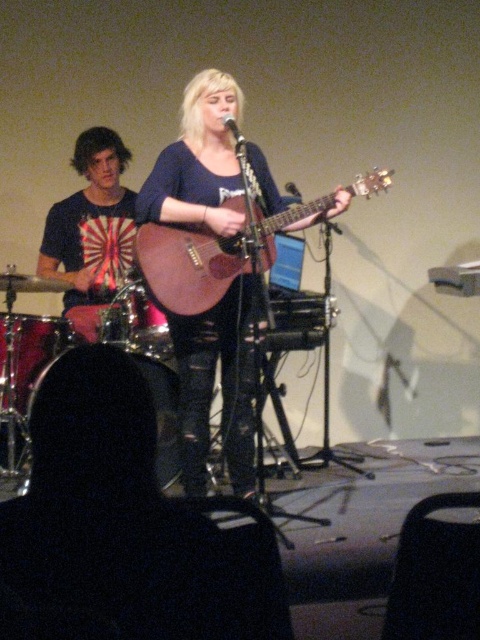
Find the location of a particular element. Image resolution: width=480 pixels, height=640 pixels. shiny silver drum at lower left is located at coordinates (105, 419).

How much distance is there between shiny silver drum at lower left and brushed metal drum at left?

shiny silver drum at lower left and brushed metal drum at left are 23.74 inches apart from each other.

Is point (80, 420) closer to camera compared to point (34, 337)?

Yes, point (80, 420) is in front of point (34, 337).

Find the location of a particular element. This screenshot has height=640, width=480. shiny silver drum at lower left is located at coordinates (105, 419).

Is matte brown guitar at center further to the viewer compared to shiny silver drum at lower left?

No, it is in front of shiny silver drum at lower left.

Does point (203, 417) come closer to viewer compared to point (132, 419)?

No, it is behind (132, 419).

Does point (244, 307) come closer to viewer compared to point (126, 362)?

No, it is behind (126, 362).

Locate an element on the screen. The image size is (480, 640). matte brown guitar at center is located at coordinates (213, 387).

Between matte brown guitar at center and brushed metal drum at lower left, which one appears on the right side from the viewer's perspective?

Positioned to the right is matte brown guitar at center.

Which is above, matte brown guitar at center or brushed metal drum at lower left?

matte brown guitar at center is higher up.

Does point (237, 314) come in front of point (140, 328)?

Yes, it is.

Identify the location of matte brown guitar at center. (213, 387).